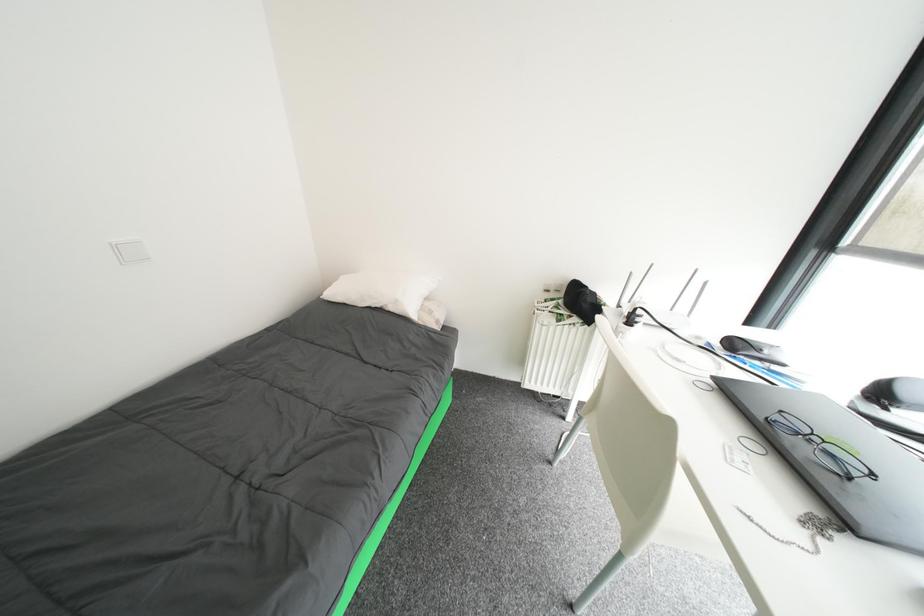
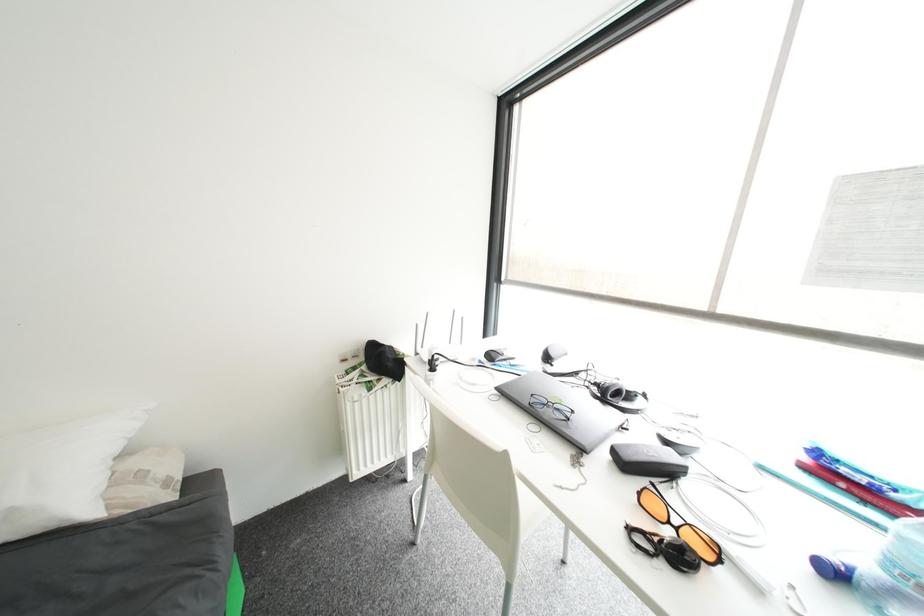
Question: The camera is either moving clockwise (left) or counter-clockwise (right) around the object. The first image is from the beginning of the video and the second image is from the end. Is the camera moving left or right when shooting the video?

Choices:
 (A) Left
 (B) Right

Answer: (A)